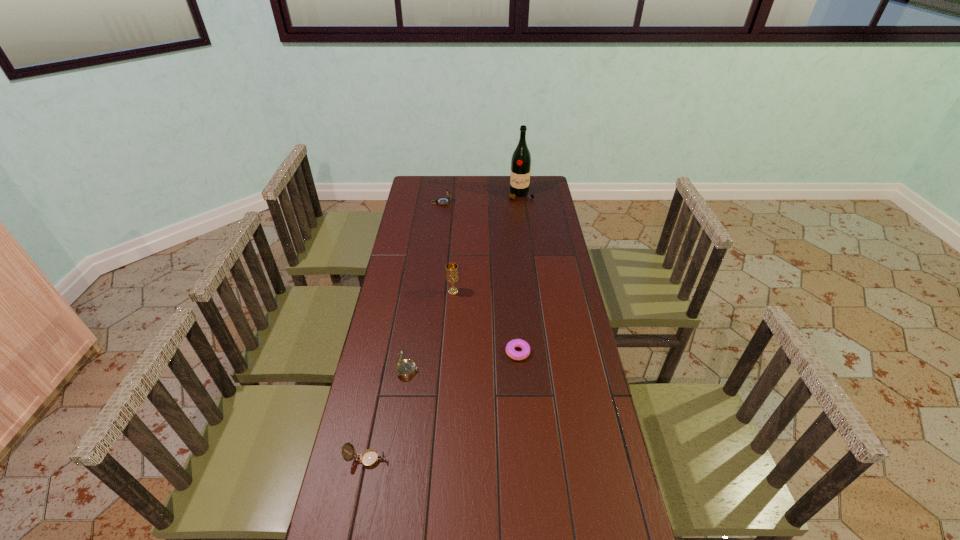
Locate an element on the screen. wine bottle is located at coordinates (521, 159).

Identify the location of chalice. (452, 276).

The height and width of the screenshot is (540, 960). I want to click on the fourth nearest object, so click(x=452, y=276).

Locate an element on the screen. the farthest compass is located at coordinates (442, 200).

This screenshot has width=960, height=540. Identify the location of the second farthest compass. (405, 368).

At what (x,y) coordinates should I click in order to perform the action: click on the nearest object. Please return your answer as a coordinate pair (x, y). Looking at the image, I should click on (369, 458).

The image size is (960, 540). I want to click on the nearest compass, so click(369, 458).

Image resolution: width=960 pixels, height=540 pixels. Find the location of `doughnut`. doughnut is located at coordinates [510, 347].

Find the location of a particular element. free spot located 0.220m on the surface of the tallest object is located at coordinates (525, 227).

Image resolution: width=960 pixels, height=540 pixels. Identify the location of free space located 0.300m on the back of the fourth nearest object. (456, 242).